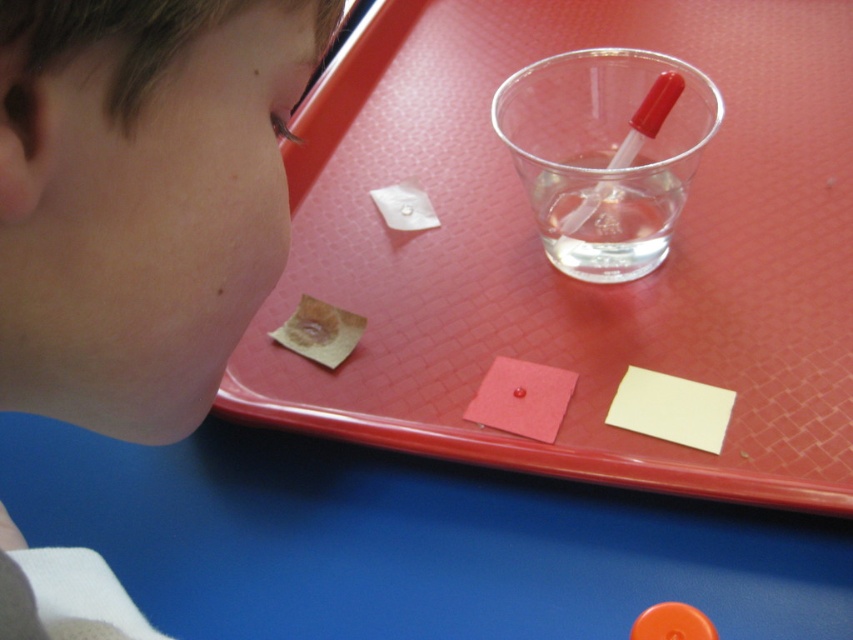
Question: Does transparent plastic cup at upper right appear on the left side of transparent plastic straw at upper center?

Choices:
 (A) no
 (B) yes

Answer: (B)

Question: In this image, where is transparent liquid at center located relative to orange matte button at lower right?

Choices:
 (A) left
 (B) right

Answer: (B)

Question: Which point is closer to the camera?

Choices:
 (A) (640, 182)
 (B) (637, 160)
 (C) (318, 285)
 (D) (688, 618)

Answer: (D)

Question: Does red plastic tray at upper center appear under transparent plastic straw at upper center?

Choices:
 (A) yes
 (B) no

Answer: (B)

Question: Based on their relative distances, which object is nearer to the transparent plastic straw at upper center?

Choices:
 (A) orange matte button at lower right
 (B) red plastic tray at upper center
 (C) transparent plastic cup at upper right
 (D) transparent liquid at center

Answer: (D)

Question: Which point appears farthest from the camera in this image?

Choices:
 (A) (550, 260)
 (B) (639, 147)
 (C) (317, 36)

Answer: (A)